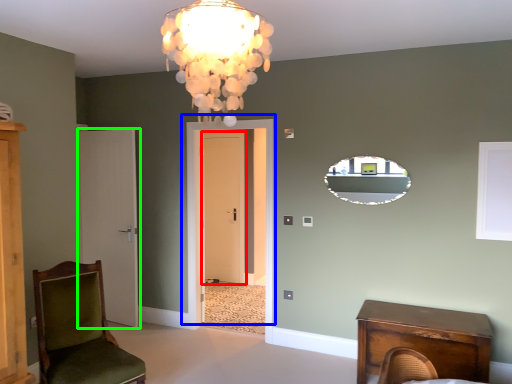
Question: Based on their relative distances, which object is farther from door (highlighted by a red box)? Choose from door (highlighted by a blue box) and door (highlighted by a green box).

Choices:
 (A) door
 (B) door

Answer: (B)